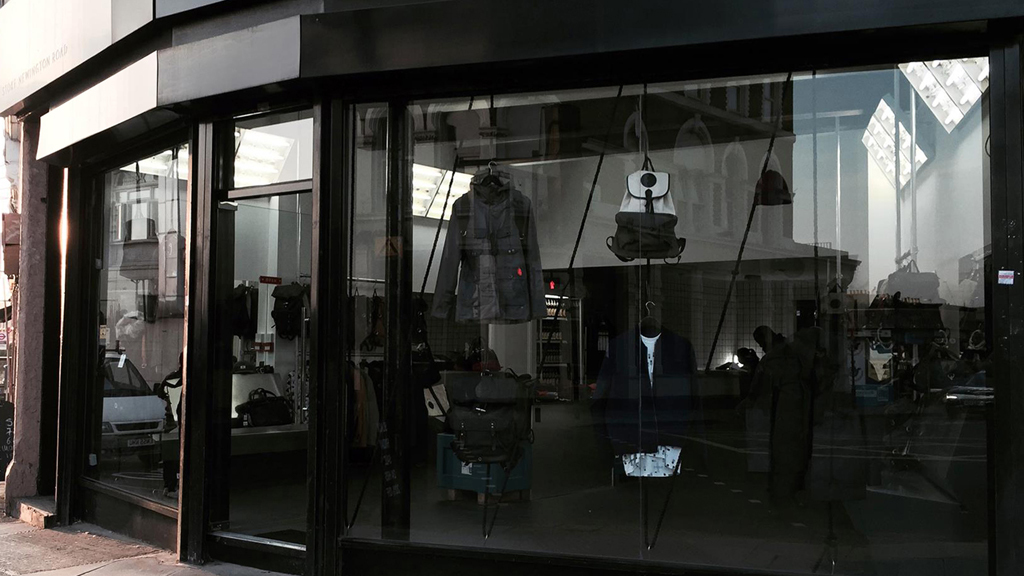
The image size is (1024, 576). In order to click on rack in this screenshot , I will do `click(486, 504)`.